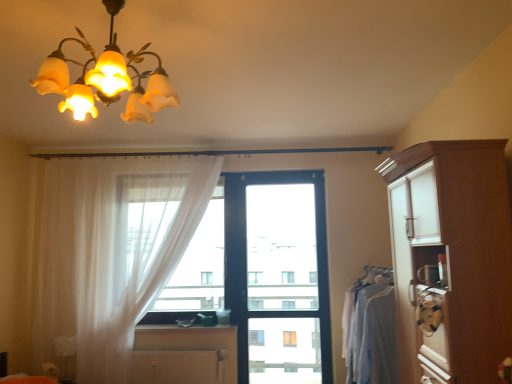
Question: From a real-world perspective, relative to brown wood cabinet at right, the 1th cabinetry when ordered from top to bottom, is translucent fabric at center vertically above or below?

Choices:
 (A) above
 (B) below

Answer: (A)

Question: Considering the positions of translucent fabric at center and brown wood cabinet at right, placed as the first cabinetry when sorted from front to back, in the image, is translucent fabric at center taller or shorter than brown wood cabinet at right, placed as the first cabinetry when sorted from front to back,?

Choices:
 (A) short
 (B) tall

Answer: (B)

Question: Which object is the closest to the light gray fabric at right?

Choices:
 (A) translucent fabric at center
 (B) brown wood cabinet at right, which appears as the 2th cabinetry when viewed from the left
 (C) smooth wooden counter top at center
 (D) white matte cabinet at lower center, the 1th cabinetry positioned from the left
 (E) white sheer curtain at center

Answer: (B)

Question: Estimate the real-world distances between objects in this image. Which object is farther from the white sheer curtain at center?

Choices:
 (A) black plastic window at center
 (B) brown wood cabinet at right, placed as the first cabinetry when sorted from front to back
 (C) translucent fabric at center
 (D) smooth wooden counter top at center
 (E) light gray fabric at right

Answer: (B)